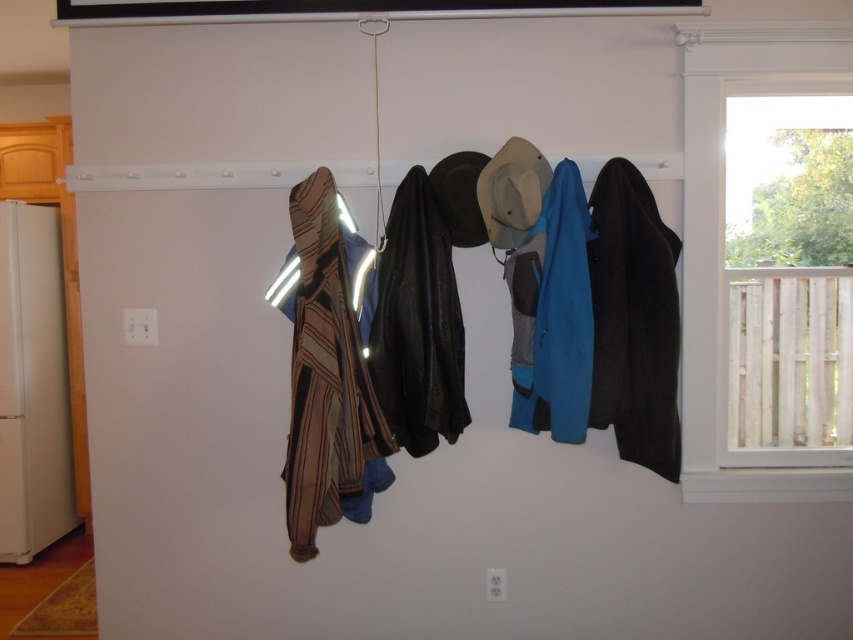
Find the location of a particular element. black wool coat at right is located at coordinates (634, 320).

Between point (56, 426) and point (523, 173), which one is positioned in front?

Point (523, 173) is in front.

Does point (19, 468) come behind point (523, 180)?

Yes, it is.

Who is more forward, (x=21, y=333) or (x=527, y=204)?

Point (x=527, y=204) is more forward.

This screenshot has width=853, height=640. Find the location of `white matte refrigerator at left`. white matte refrigerator at left is located at coordinates (32, 385).

Can you confirm if striped fabric scarf at left is shorter than black wool coat at right?

No.

Is striped fabric scarf at left above black wool coat at right?

Actually, striped fabric scarf at left is below black wool coat at right.

This screenshot has height=640, width=853. Identify the location of striped fabric scarf at left. point(326,374).

Find the location of a particular element. Image resolution: width=853 pixels, height=640 pixels. striped fabric scarf at left is located at coordinates pos(326,374).